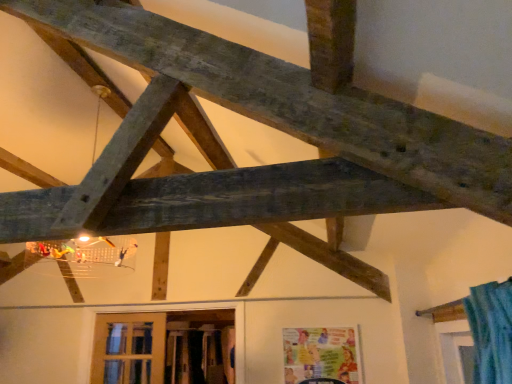
Question: Which direction should I rotate to look at wooden frame at lower center, the first window when ordered from right to left?

Choices:
 (A) left
 (B) right

Answer: (A)

Question: Is wooden frame at lower center, placed as the second window when sorted from left to right, completely or partially inside wooden-framed window at lower left, which is the first window in left-to-right order?

Choices:
 (A) no
 (B) yes

Answer: (A)

Question: From a real-world perspective, is wooden-framed window at lower left, which is the first window in left-to-right order, positioned over wooden frame at lower center, the first window when ordered from right to left, based on gravity?

Choices:
 (A) yes
 (B) no

Answer: (B)

Question: Is wooden-framed window at lower left, which is the first window in left-to-right order, far from wooden frame at lower center, placed as the second window when sorted from left to right?

Choices:
 (A) no
 (B) yes

Answer: (A)

Question: Is wooden-framed window at lower left, which is the first window in left-to-right order, positioned in front of wooden frame at lower center, placed as the second window when sorted from left to right?

Choices:
 (A) yes
 (B) no

Answer: (B)

Question: From the image's perspective, is wooden-framed window at lower left, which is the first window in left-to-right order, beneath wooden frame at lower center, the first window when ordered from right to left?

Choices:
 (A) no
 (B) yes

Answer: (B)

Question: Does wooden-framed window at lower left, the 2th window viewed from the right, have a smaller size compared to wooden frame at lower center, placed as the second window when sorted from left to right?

Choices:
 (A) yes
 (B) no

Answer: (A)

Question: Is wooden frame at lower center, the first window when ordered from right to left, to the right of wooden-framed window at lower left, the 2th window viewed from the right, from the viewer's perspective?

Choices:
 (A) yes
 (B) no

Answer: (A)

Question: Is wooden frame at lower center, placed as the second window when sorted from left to right, located outside wooden-framed window at lower left, which is the first window in left-to-right order?

Choices:
 (A) yes
 (B) no

Answer: (A)

Question: Can you confirm if wooden frame at lower center, the first window when ordered from right to left, is bigger than wooden-framed window at lower left, which is the first window in left-to-right order?

Choices:
 (A) yes
 (B) no

Answer: (A)

Question: Is wooden frame at lower center, placed as the second window when sorted from left to right, far away from wooden-framed window at lower left, which is the first window in left-to-right order?

Choices:
 (A) yes
 (B) no

Answer: (B)

Question: Considering the relative sizes of wooden frame at lower center, the first window when ordered from right to left, and wooden-framed window at lower left, the 2th window viewed from the right, in the image provided, is wooden frame at lower center, the first window when ordered from right to left, wider than wooden-framed window at lower left, the 2th window viewed from the right,?

Choices:
 (A) yes
 (B) no

Answer: (A)

Question: Does wooden frame at lower center, placed as the second window when sorted from left to right, lie behind wooden-framed window at lower left, which is the first window in left-to-right order?

Choices:
 (A) no
 (B) yes

Answer: (A)

Question: From a real-world perspective, is wooden frame at lower center, the first window when ordered from right to left, positioned above or below wooden-framed window at lower left, which is the first window in left-to-right order?

Choices:
 (A) below
 (B) above

Answer: (B)